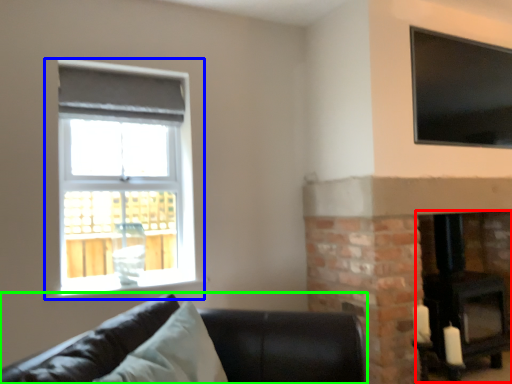
Question: Which object is positioned farthest from fireplace (highlighted by a red box)? Select from window (highlighted by a blue box) and studio couch (highlighted by a green box).

Choices:
 (A) window
 (B) studio couch

Answer: (A)